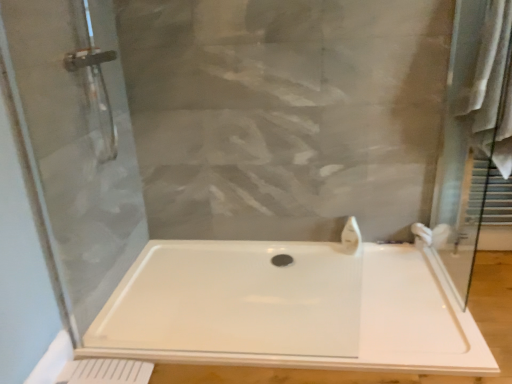
This screenshot has height=384, width=512. In order to click on free point below white fabric bath towel at right (from a real-world perspective) in this screenshot , I will do `click(481, 264)`.